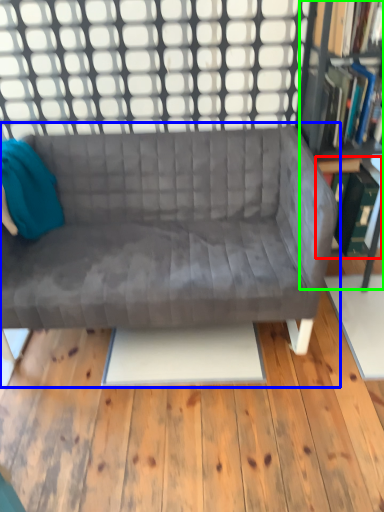
Question: Based on their relative distances, which object is farther from shelf (highlighted by a red box)? Choose from studio couch (highlighted by a blue box) and bookcase (highlighted by a green box).

Choices:
 (A) studio couch
 (B) bookcase

Answer: (A)